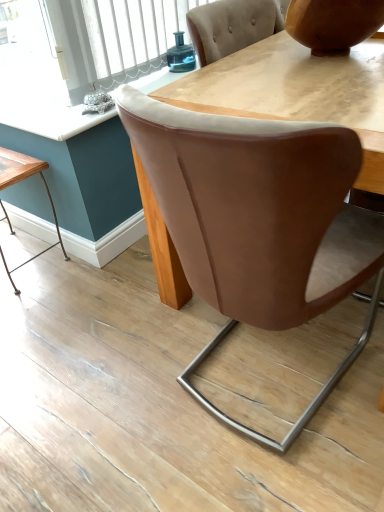
Locate an element on the screen. free space in front of matte brown vase at upper right is located at coordinates (326, 81).